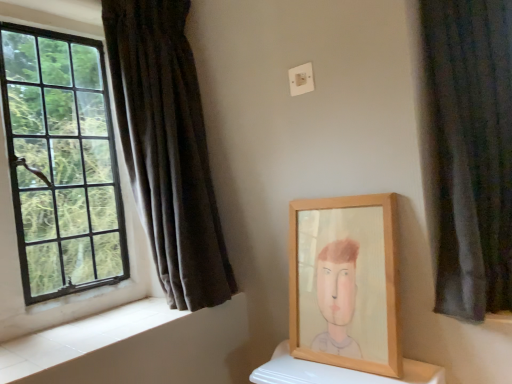
Looking at this image, measure the distance between point (93, 189) and camera.

The distance of point (93, 189) from camera is 4.91 feet.

This screenshot has width=512, height=384. I want to click on dark velvet curtain at left, which appears as the 2th curtain when viewed from the front, so [167, 148].

Locate an element on the screen. This screenshot has width=512, height=384. white tile at lower left is located at coordinates (136, 347).

Image resolution: width=512 pixels, height=384 pixels. Describe the element at coordinates (136, 347) in the screenshot. I see `white tile at lower left` at that location.

The height and width of the screenshot is (384, 512). What do you see at coordinates (346, 283) in the screenshot?
I see `wooden frame at center` at bounding box center [346, 283].

The height and width of the screenshot is (384, 512). What are the coordinates of `dark velvet curtain at right, arranged as the 1th curtain when viewed from the front` in the screenshot? It's located at (468, 152).

Could you tell me if dark velvet curtain at left, the 1th curtain when ordered from left to right, is facing black glass window at left?

No, dark velvet curtain at left, the 1th curtain when ordered from left to right, is not turned towards black glass window at left.

Is black glass window at left located within dark velvet curtain at left, the 2th curtain in the right-to-left sequence?

No, black glass window at left is not a part of dark velvet curtain at left, the 2th curtain in the right-to-left sequence.

Considering the positions of objects dark velvet curtain at left, the 2th curtain in the right-to-left sequence, and black glass window at left in the image provided, who is behind, dark velvet curtain at left, the 2th curtain in the right-to-left sequence, or black glass window at left?

dark velvet curtain at left, the 2th curtain in the right-to-left sequence, is behind.

Is point (212, 289) positioned in front of point (103, 278)?

Yes, it is in front of point (103, 278).

From the image's perspective, is wooden frame at center on black glass window at left?

Actually, wooden frame at center appears below black glass window at left in the image.

Where is `window behind the wooden frame at center`? This screenshot has height=384, width=512. window behind the wooden frame at center is located at coordinates (61, 162).

Is black glass window at left located within wooden frame at center?

Definitely not — black glass window at left is not inside wooden frame at center.

Is black glass window at left at the back of wooden frame at center?

That's not correct — wooden frame at center is not looking away from black glass window at left.

In the scene shown: Which is nearer, (6, 46) or (72, 368)?

Point (6, 46) is positioned farther from the camera compared to point (72, 368).

How much distance is there between black glass window at left and white tile at lower left?

black glass window at left is 18.04 inches away from white tile at lower left.

This screenshot has width=512, height=384. What are the coordinates of `window above the white tile at lower left (from the image's perspective)` in the screenshot? It's located at (61, 162).

Where is `window sill lying behind the dark velvet curtain at right, the 1th curtain when ordered from right to left`? The height and width of the screenshot is (384, 512). window sill lying behind the dark velvet curtain at right, the 1th curtain when ordered from right to left is located at coordinates [136, 347].

Is dark velvet curtain at right, the 1th curtain when ordered from right to left, positioned beyond the bounds of white tile at lower left?

Yes, dark velvet curtain at right, the 1th curtain when ordered from right to left, is located beyond the bounds of white tile at lower left.

Considering the relative sizes of dark velvet curtain at right, which is the 2th curtain in back-to-front order, and white tile at lower left in the image provided, is dark velvet curtain at right, which is the 2th curtain in back-to-front order, shorter than white tile at lower left?

No, dark velvet curtain at right, which is the 2th curtain in back-to-front order, is not shorter than white tile at lower left.

Which of these two, dark velvet curtain at right, which is the 2th curtain in back-to-front order, or white tile at lower left, is smaller?

With smaller size is white tile at lower left.

Are white tile at lower left and wooden frame at center far apart?

white tile at lower left is actually quite close to wooden frame at center.

Considering their positions, is white tile at lower left located in front of or behind wooden frame at center?

white tile at lower left is positioned closer to the viewer than wooden frame at center.

Consider the image. Considering the sizes of white tile at lower left and wooden frame at center in the image, is white tile at lower left bigger or smaller than wooden frame at center?

white tile at lower left is smaller than wooden frame at center.

In the scene shown: Is white tile at lower left facing away from wooden frame at center?

No.

Measure the distance from black glass window at left to wooden frame at center.

They are 31.87 inches apart.

Between black glass window at left and wooden frame at center, which one is positioned behind?

black glass window at left is more distant.

Is black glass window at left facing towards wooden frame at center?

Yes, black glass window at left is turned towards wooden frame at center.

Considering the sizes of dark velvet curtain at right, the 1th curtain when ordered from right to left, and dark velvet curtain at left, the 1th curtain when ordered from left to right, in the image, is dark velvet curtain at right, the 1th curtain when ordered from right to left, taller or shorter than dark velvet curtain at left, the 1th curtain when ordered from left to right,?

Considering their sizes, dark velvet curtain at right, the 1th curtain when ordered from right to left, has less height than dark velvet curtain at left, the 1th curtain when ordered from left to right.

Looking at this image, from a real-world perspective, is dark velvet curtain at right, arranged as the 1th curtain when viewed from the front, on top of dark velvet curtain at left, which appears as the 2th curtain when viewed from the front?

No.

Looking at their sizes, would you say dark velvet curtain at right, the 1th curtain when ordered from right to left, is wider or thinner than dark velvet curtain at left, the 1th curtain from the back?

In the image, dark velvet curtain at right, the 1th curtain when ordered from right to left, appears to be more narrow than dark velvet curtain at left, the 1th curtain from the back.

Is dark velvet curtain at right, arranged as the 1th curtain when viewed from the front, looking in the opposite direction of dark velvet curtain at left, which appears as the 2th curtain when viewed from the front?

dark velvet curtain at right, arranged as the 1th curtain when viewed from the front, is not turned away from dark velvet curtain at left, which appears as the 2th curtain when viewed from the front.

I want to click on the 1st curtain to the right when counting from the black glass window at left, so click(x=167, y=148).

What are the coordinates of `window behind the wooden frame at center` in the screenshot? It's located at (61, 162).

When comparing their distances from dark velvet curtain at left, the 1th curtain from the back, does wooden frame at center or dark velvet curtain at right, arranged as the 1th curtain when viewed from the front, seem further?

The object further to dark velvet curtain at left, the 1th curtain from the back, is dark velvet curtain at right, arranged as the 1th curtain when viewed from the front.

When comparing their distances from black glass window at left, does dark velvet curtain at right, arranged as the 1th curtain when viewed from the front, or wooden frame at center seem further?

Based on the image, dark velvet curtain at right, arranged as the 1th curtain when viewed from the front, appears to be further to black glass window at left.

Which object lies nearer to the anchor point wooden frame at center, white tile at lower left or dark velvet curtain at left, the 2th curtain in the right-to-left sequence?

white tile at lower left.

From the image, which object appears to be farther from black glass window at left, white tile at lower left or dark velvet curtain at left, the 1th curtain when ordered from left to right?

white tile at lower left lies further to black glass window at left than the other object.

Which object lies nearer to the anchor point black glass window at left, dark velvet curtain at left, the 2th curtain in the right-to-left sequence, or dark velvet curtain at right, which is the 2th curtain in back-to-front order?

dark velvet curtain at left, the 2th curtain in the right-to-left sequence, is closer to black glass window at left.

From the picture: When comparing their distances from white tile at lower left, does wooden frame at center or black glass window at left seem further?

wooden frame at center lies further to white tile at lower left than the other object.

From the image, which object appears to be nearer to dark velvet curtain at right, arranged as the 1th curtain when viewed from the front, black glass window at left or wooden frame at center?

Among the two, wooden frame at center is located nearer to dark velvet curtain at right, arranged as the 1th curtain when viewed from the front.

Looking at the image, which one is located further to white tile at lower left, dark velvet curtain at left, the 1th curtain when ordered from left to right, or dark velvet curtain at right, the 1th curtain when ordered from right to left?

The object further to white tile at lower left is dark velvet curtain at right, the 1th curtain when ordered from right to left.

In order to click on curtain between black glass window at left and wooden frame at center from left to right in this screenshot , I will do `click(167, 148)`.

Image resolution: width=512 pixels, height=384 pixels. Identify the location of curtain situated between white tile at lower left and dark velvet curtain at right, the 1th curtain when ordered from right to left, from left to right. (167, 148).

Where is `picture frame between black glass window at left and dark velvet curtain at right, arranged as the 1th curtain when viewed from the front`? The width and height of the screenshot is (512, 384). picture frame between black glass window at left and dark velvet curtain at right, arranged as the 1th curtain when viewed from the front is located at coordinates (346, 283).

Locate an element on the screen. Image resolution: width=512 pixels, height=384 pixels. window that lies between dark velvet curtain at left, the 1th curtain when ordered from left to right, and white tile at lower left from top to bottom is located at coordinates (61, 162).